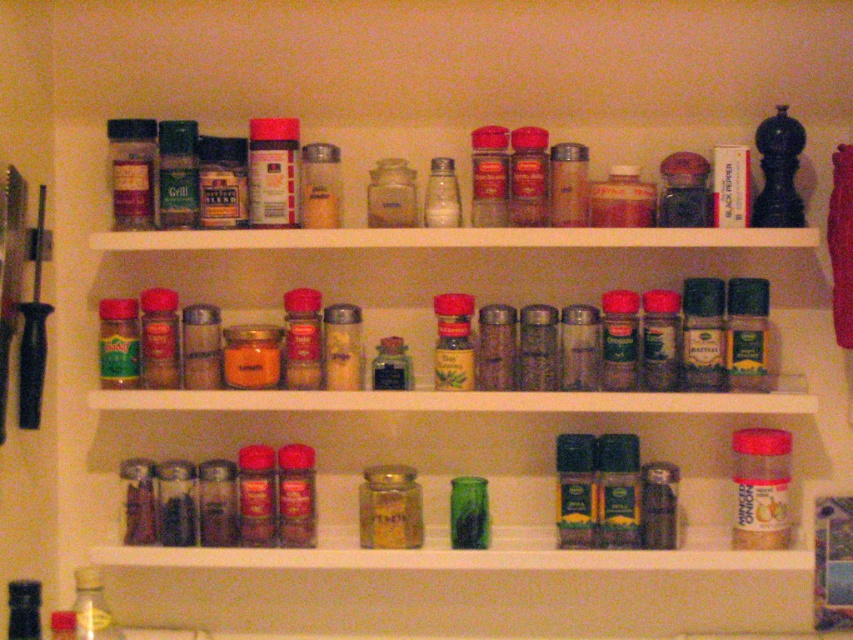
Question: Which point appears closest to the camera in this image?

Choices:
 (A) (91, 637)
 (B) (415, 490)

Answer: (A)

Question: Is translucent glass jar at center bigger than green glass jar at lower center?

Choices:
 (A) no
 (B) yes

Answer: (A)

Question: Which of the following is the farthest from the observer?

Choices:
 (A) (399, 506)
 (B) (109, 637)

Answer: (A)

Question: Which point is closer to the camera taking this photo?

Choices:
 (A) (405, 496)
 (B) (117, 636)

Answer: (B)

Question: Can you confirm if translucent glass jar at center is positioned to the left of green glass jar at lower center?

Choices:
 (A) no
 (B) yes

Answer: (A)

Question: Does translucent glass jar at center have a larger size compared to green glass jar at lower center?

Choices:
 (A) no
 (B) yes

Answer: (A)